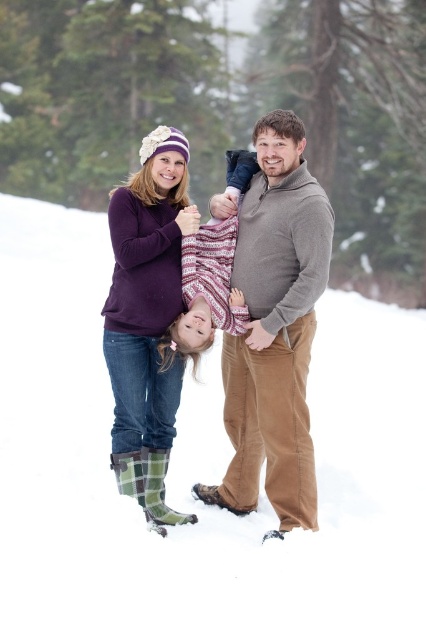
Who is positioned more to the right, plaid wool boots at lower left or knitted sweater at center?

knitted sweater at center is more to the right.

Describe the element at coordinates (146, 320) in the screenshot. The image size is (426, 640). I see `plaid wool boots at lower left` at that location.

Who is more distant from viewer, (155,132) or (190,275)?

The point (190,275) is behind.

You are a GUI agent. You are given a task and a screenshot of the screen. Output one action in this format:
    pyautogui.click(x=<x>, y=<y>)
    Task: Click on the plaid wool boots at lower left
    This screenshot has width=426, height=640.
    Given the screenshot: What is the action you would take?
    pyautogui.click(x=146, y=320)

Does white fluffy snow at center have a greater height compared to knitted sweater at center?

Yes, white fluffy snow at center is taller than knitted sweater at center.

Does point (380, 577) come closer to viewer compared to point (215, 314)?

Yes, it is.

Is point (411, 310) in front of point (236, 195)?

No, it is behind (236, 195).

What are the coordinates of `white fluffy snow at center` in the screenshot? It's located at (196, 472).

Which of these two, white fluffy snow at center or brown corduroy pants at center, stands shorter?

Standing shorter between the two is white fluffy snow at center.

Who is more forward, [129,614] or [282,189]?

Point [129,614] is in front.

You are a GUI agent. You are given a task and a screenshot of the screen. Output one action in this format:
    pyautogui.click(x=<x>, y=<y>)
    Task: Click on the white fluffy snow at center
    This screenshot has width=426, height=640.
    Given the screenshot: What is the action you would take?
    pyautogui.click(x=196, y=472)